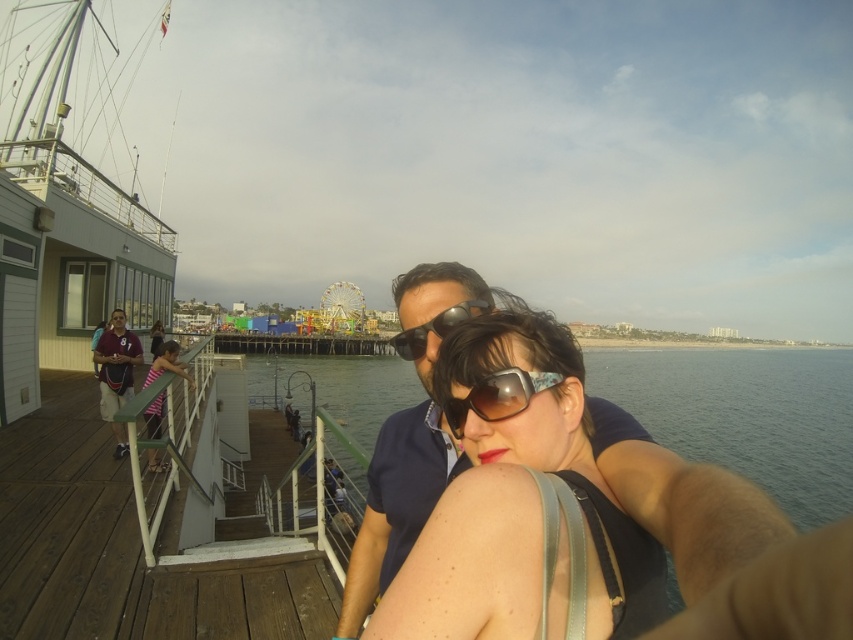
You are standing on the pier and want to take a photo of two points marked in the image. The first point is at coordinate point(76,598) and the second point is at coordinate point(109,356). Which point should you focus on first if you want to capture the one that is nearer to you?

Point(76,598) is closer to the viewer than point(109,356), so you should focus on point(76,598) first.

You are standing on the brown wooden deck at lower left and want to toss a frisbee to someone holding the maroon jersey at left. Considering the deck might be wider than the jersey, where should you aim to ensure the frisbee reaches the jersey holder?

Since the brown wooden deck at lower left might be wider than the maroon jersey at left, aim towards the narrower side of the deck closer to the jersey to ensure the frisbee reaches the jersey holder.

You are a photographer trying to capture the entire pier scene. You notice the clear blue water at center and the black plastic sunglasses at center. Which object is wider in the image?

The clear blue water at center is wider than the black plastic sunglasses at center according to the description.